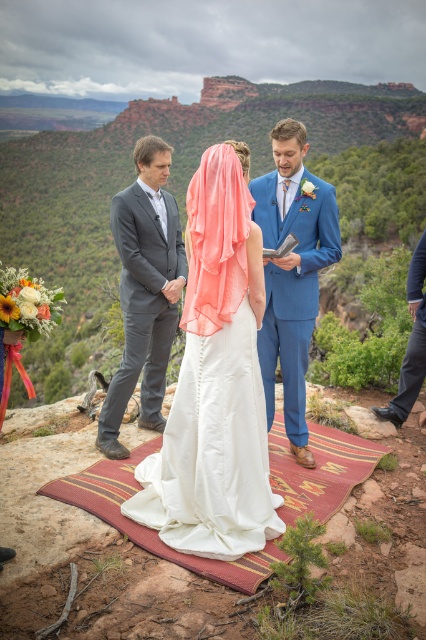
Is matte gray suit at left thinner than textured wool rug at center?

Indeed, matte gray suit at left has a lesser width compared to textured wool rug at center.

Between matte gray suit at left and textured wool rug at center, which one has less height?

textured wool rug at center

What do you see at coordinates (144, 291) in the screenshot? I see `matte gray suit at left` at bounding box center [144, 291].

The image size is (426, 640). What are the coordinates of `matte gray suit at left` in the screenshot? It's located at (144, 291).

Can you confirm if textured wool rug at center is wider than dark blue jeans at lower right?

Yes, textured wool rug at center is wider than dark blue jeans at lower right.

Which is more to the left, textured wool rug at center or dark blue jeans at lower right?

From the viewer's perspective, textured wool rug at center appears more on the left side.

Between point (178, 561) and point (400, 394), which one is positioned behind?

Positioned behind is point (400, 394).

Locate an element on the screen. The image size is (426, 640). textured wool rug at center is located at coordinates [150, 529].

Which is behind, point (265, 468) or point (152, 173)?

Point (152, 173)

The height and width of the screenshot is (640, 426). I want to click on white satin dress at center, so click(x=215, y=385).

Find the location of a particular element. Image resolution: width=426 pixels, height=640 pixels. white satin dress at center is located at coordinates (215, 385).